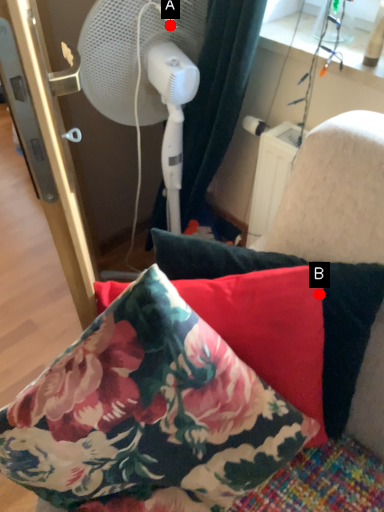
Question: Two points are circled on the image, labeled by A and B beside each circle. Which point is closer to the camera?

Choices:
 (A) A is closer
 (B) B is closer

Answer: (B)